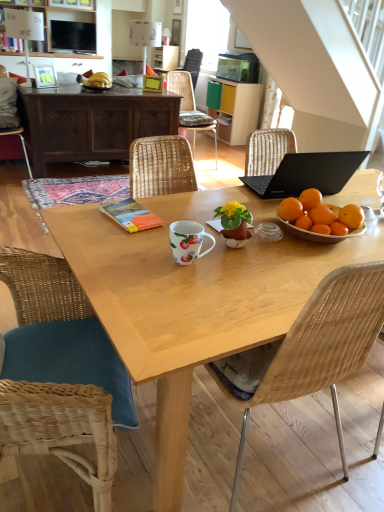
You are a GUI agent. You are given a task and a screenshot of the screen. Output one action in this format:
    pyautogui.click(x=<x>, y=<y>)
    Task: Click on the free space to the left of orange matte book at center
    
    Given the screenshot: What is the action you would take?
    pyautogui.click(x=82, y=216)